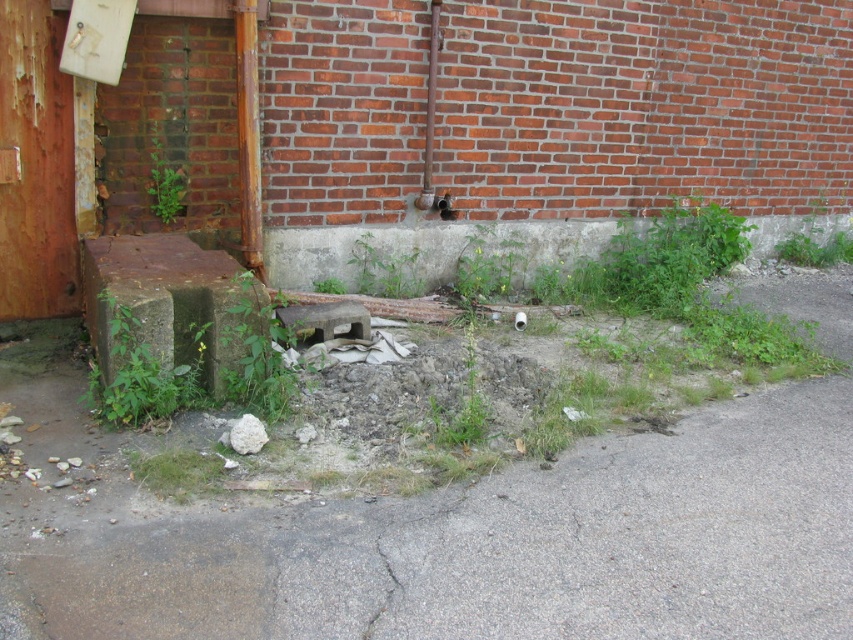
Which is below, green leafy weed at center or green leafy plant at center-left?

green leafy weed at center

Where is `green leafy weed at center`? The image size is (853, 640). green leafy weed at center is located at coordinates (256, 352).

Find the location of `green leafy weed at center`. green leafy weed at center is located at coordinates (256, 352).

Does green leafy weed at lower left appear on the left side of green leafy plant at center-left?

No, green leafy weed at lower left is not to the left of green leafy plant at center-left.

Does point (131, 362) come closer to viewer compared to point (164, 196)?

Yes.

You are a GUI agent. You are given a task and a screenshot of the screen. Output one action in this format:
    pyautogui.click(x=<x>, y=<y>)
    Task: Click on the green leafy weed at lower left
    
    Given the screenshot: What is the action you would take?
    pyautogui.click(x=142, y=371)

Identify the location of green leafy weed at lower left. (142, 371).

Is point (509, 634) in front of point (103, 400)?

Yes, point (509, 634) is in front of point (103, 400).

The width and height of the screenshot is (853, 640). What do you see at coordinates (486, 545) in the screenshot?
I see `gray asphalt pavement at lower center` at bounding box center [486, 545].

Identify the location of gray asphalt pavement at lower center. (486, 545).